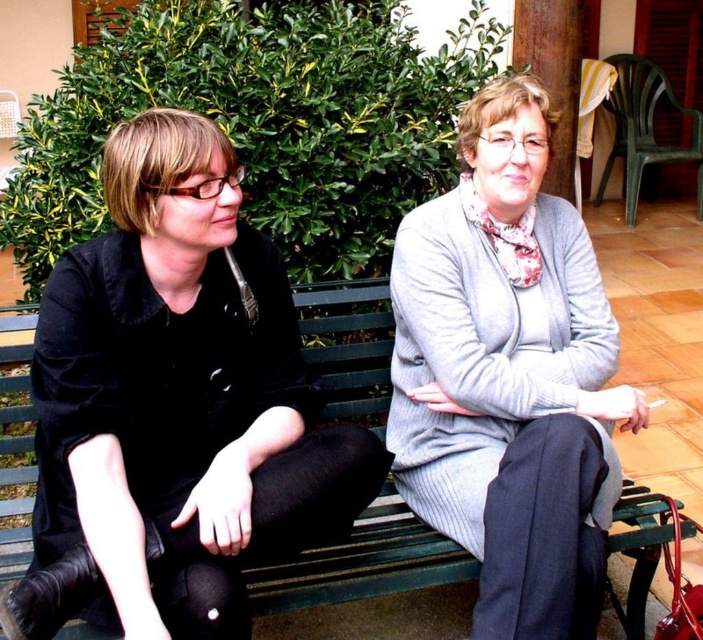
Can you confirm if black velvet jacket at left is positioned to the left of green wooden bench at center?

Correct, you'll find black velvet jacket at left to the left of green wooden bench at center.

Describe the element at coordinates (180, 394) in the screenshot. This screenshot has width=703, height=640. I see `black velvet jacket at left` at that location.

This screenshot has height=640, width=703. What do you see at coordinates (180, 394) in the screenshot? I see `black velvet jacket at left` at bounding box center [180, 394].

Identify the location of black velvet jacket at left. (180, 394).

Is gray woolen sweater at center taller than green wooden bench at center?

Indeed, gray woolen sweater at center has a greater height compared to green wooden bench at center.

Looking at this image, does gray woolen sweater at center appear over green wooden bench at center?

Yes, gray woolen sweater at center is above green wooden bench at center.

Find the location of a particular element. gray woolen sweater at center is located at coordinates (508, 376).

Does black velvet jacket at left appear over gray woolen sweater at center?

Incorrect, black velvet jacket at left is not positioned above gray woolen sweater at center.

Does black velvet jacket at left have a lesser height compared to gray woolen sweater at center?

Yes, black velvet jacket at left is shorter than gray woolen sweater at center.

Which is in front, point (38, 440) or point (588, 276)?

Point (38, 440) is more forward.

I want to click on black velvet jacket at left, so click(x=180, y=394).